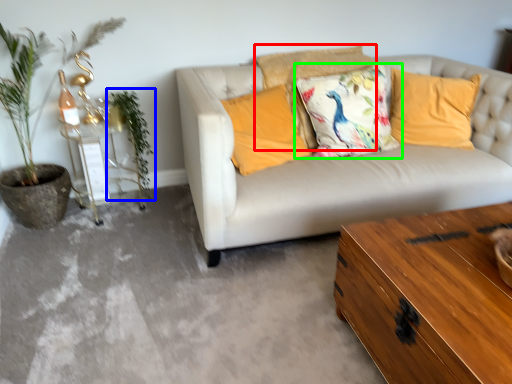
Question: Based on their relative distances, which object is farther from pillow (highlighted by a red box)? Choose from plant (highlighted by a blue box) and pillow (highlighted by a green box).

Choices:
 (A) plant
 (B) pillow

Answer: (A)